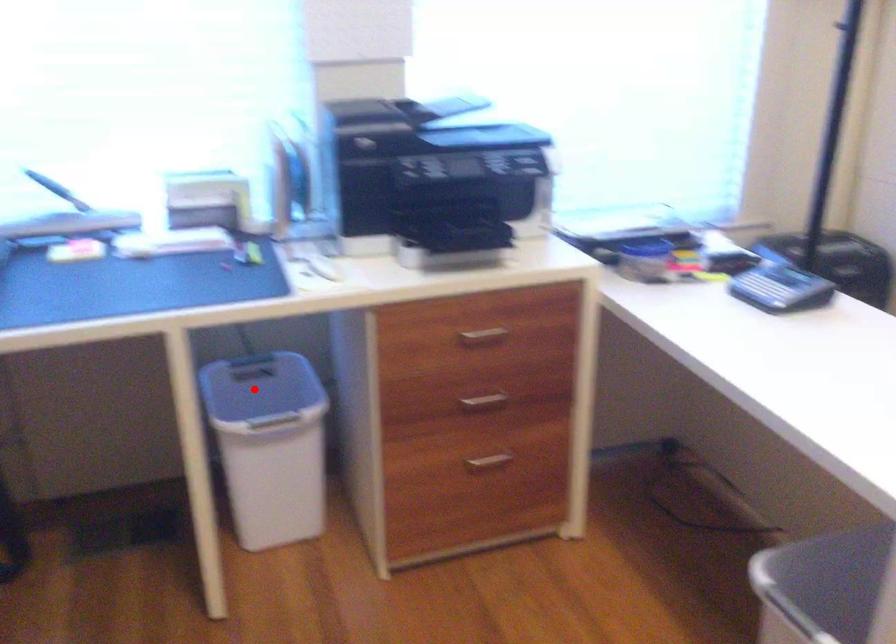
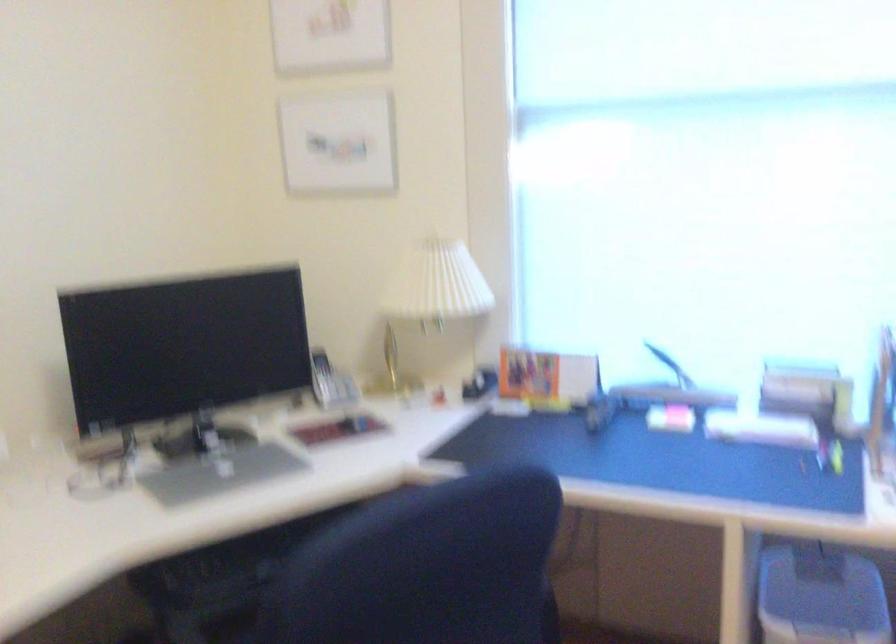
In the second image, find the point that corresponds to the highlighted location in the first image.

(821, 596)